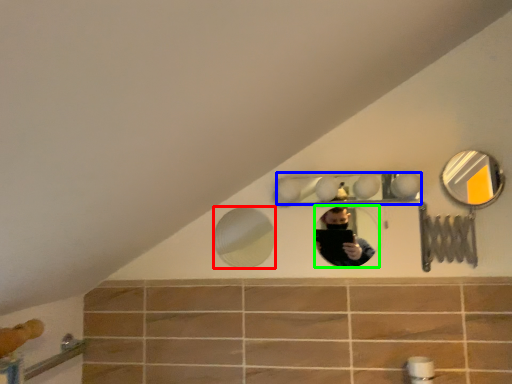
Question: Which object is the closest to the mirror (highlighted by a red box)? Choose among these: mirror (highlighted by a blue box) or mirror (highlighted by a green box).

Choices:
 (A) mirror
 (B) mirror

Answer: (B)